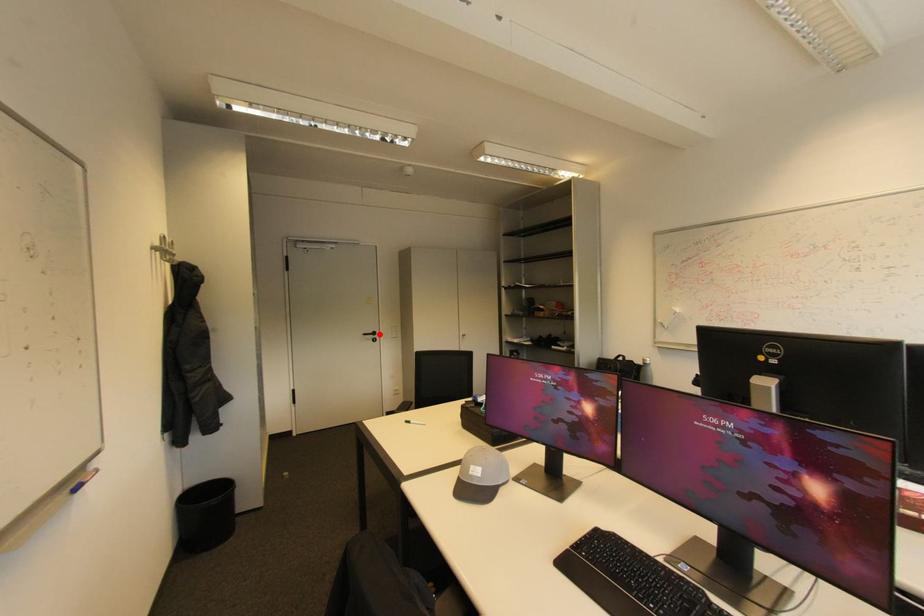
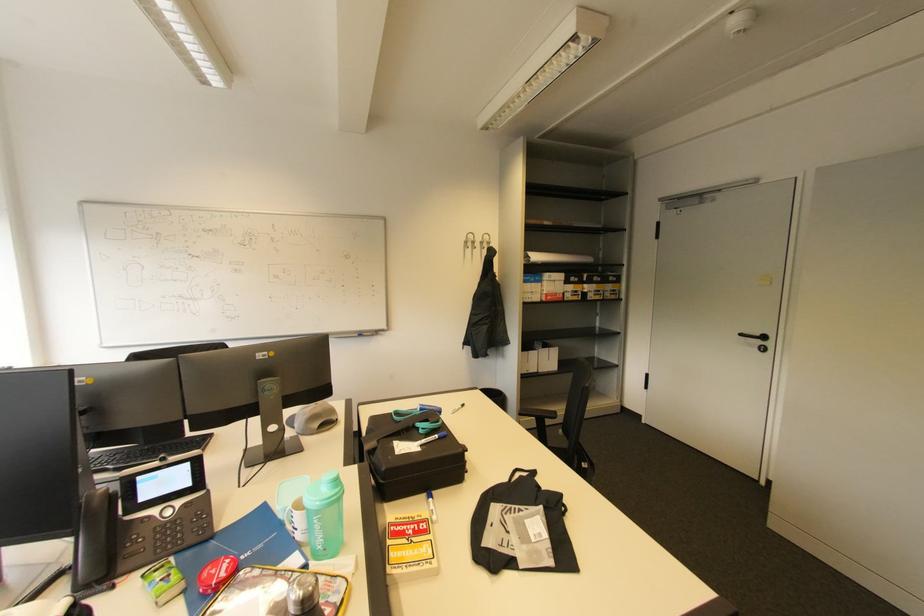
The point at the highlighted location is marked in the first image. Where is the corresponding point in the second image?

(769, 339)